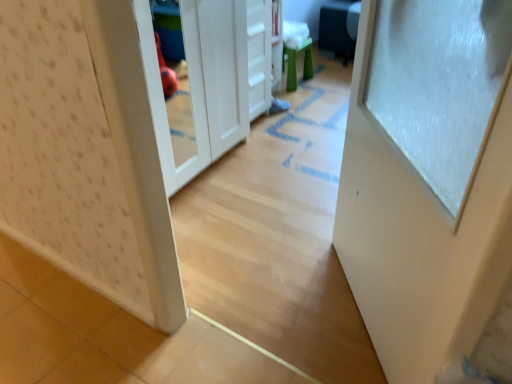
Describe the element at coordinates (431, 188) in the screenshot. The width and height of the screenshot is (512, 384). I see `white glossy door at right` at that location.

The image size is (512, 384). In order to click on white glossy door at right in this screenshot , I will do `click(431, 188)`.

Locate an element on the screen. The width and height of the screenshot is (512, 384). white glossy door at right is located at coordinates (431, 188).

Considering the sizes of objects white glossy door at right and green rubber stool at center in the image provided, who is bigger, white glossy door at right or green rubber stool at center?

With larger size is white glossy door at right.

Considering the sizes of objects white glossy door at right and green rubber stool at center in the image provided, who is thinner, white glossy door at right or green rubber stool at center?

white glossy door at right.

From the image's perspective, is white glossy door at right over green rubber stool at center?

Actually, white glossy door at right appears below green rubber stool at center in the image.

Is white glossy door at right inside the boundaries of green rubber stool at center, or outside?

white glossy door at right is outside green rubber stool at center.

In the scene shown: Is green rubber stool at center to the left or to the right of white matte drawer at center in the image?

green rubber stool at center is positioned on white matte drawer at center's right side.

From the image's perspective, is green rubber stool at center above or below white matte drawer at center?

From the image's perspective, green rubber stool at center appears above white matte drawer at center.

Is green rubber stool at center behind white matte drawer at center?

Yes, it is behind white matte drawer at center.

Could you tell me if green rubber stool at center is facing white matte drawer at center?

No, green rubber stool at center is not oriented towards white matte drawer at center.

What's the angular difference between white matte drawer at center and green rubber stool at center's facing directions?

white matte drawer at center and green rubber stool at center are facing 2.2 degrees away from each other.

Measure the distance from white matte drawer at center to green rubber stool at center.

white matte drawer at center is 61.54 centimeters from green rubber stool at center.

Which is correct: white matte drawer at center is inside green rubber stool at center, or outside of it?

white matte drawer at center is located beyond the bounds of green rubber stool at center.

Is point (260, 77) positioned in front of point (309, 53)?

Yes, it is.

From the image's perspective, is green rubber stool at center under white glossy door at right?

No, from the image's perspective, green rubber stool at center is not beneath white glossy door at right.

In terms of size, does green rubber stool at center appear bigger or smaller than white glossy door at right?

green rubber stool at center is smaller than white glossy door at right.

Can you confirm if green rubber stool at center is wider than white glossy door at right?

Correct, the width of green rubber stool at center exceeds that of white glossy door at right.

Is white matte drawer at center wider or thinner than white glossy door at right?

Clearly, white matte drawer at center has more width compared to white glossy door at right.

Considering the points (262, 4) and (488, 271), which point is behind, point (262, 4) or point (488, 271)?

The point (262, 4) is more distant.

Would you say white matte drawer at center is outside white glossy door at right?

white matte drawer at center lies outside white glossy door at right's area.

Does point (398, 321) lie in front of point (269, 82)?

Yes, point (398, 321) is closer to viewer.

Does white glossy door at right contain white matte drawer at center?

No, white matte drawer at center is not inside white glossy door at right.

From the image's perspective, which one is positioned lower, white glossy door at right or white matte drawer at center?

From the image's view, white glossy door at right is below.

From a real-world perspective, does white glossy door at right sit lower than white matte drawer at center?

Incorrect, from a real-world perspective, white glossy door at right is higher than white matte drawer at center.

I want to click on stool behind the white glossy door at right, so click(295, 64).

You are a GUI agent. You are given a task and a screenshot of the screen. Output one action in this format:
    pyautogui.click(x=<x>, y=<y>)
    Task: Click on the drawer below the green rubber stool at center (from the image's perspective)
    This screenshot has width=512, height=384.
    Given the screenshot: What is the action you would take?
    pyautogui.click(x=259, y=56)

Which object lies further to the anchor point white matte drawer at center, green rubber stool at center or white glossy door at right?

white glossy door at right.

Which object lies further to the anchor point white glossy door at right, green rubber stool at center or white matte drawer at center?

green rubber stool at center is further to white glossy door at right.

When comparing their distances from green rubber stool at center, does white matte drawer at center or white glossy door at right seem further?

white glossy door at right is further to green rubber stool at center.

From the image, which object appears to be nearer to white glossy door at right, white matte drawer at center or green rubber stool at center?

The object closer to white glossy door at right is white matte drawer at center.

Looking at this image, from the image, which object appears to be farther from green rubber stool at center, white glossy door at right or white matte drawer at center?

white glossy door at right is further to green rubber stool at center.

From the image, which object appears to be nearer to white matte drawer at center, white glossy door at right or green rubber stool at center?

Among the two, green rubber stool at center is located nearer to white matte drawer at center.

Where is `drawer located between white glossy door at right and green rubber stool at center in the depth direction`? This screenshot has height=384, width=512. drawer located between white glossy door at right and green rubber stool at center in the depth direction is located at coordinates (259, 56).